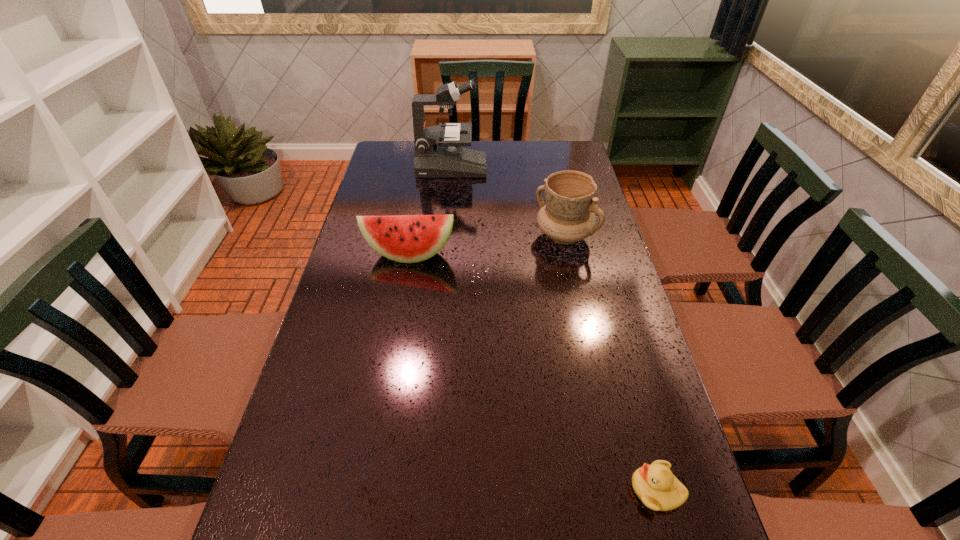
This screenshot has width=960, height=540. I want to click on vacant region located 0.100m on the front-facing side of the shortest object, so click(x=578, y=490).

Find the location of `vacant space located on the front-facing side of the shortest object`. vacant space located on the front-facing side of the shortest object is located at coordinates (567, 490).

The height and width of the screenshot is (540, 960). I want to click on object at the far edge, so click(x=438, y=149).

You are a GUI agent. You are given a task and a screenshot of the screen. Output one action in this format:
    pyautogui.click(x=<x>, y=<y>)
    Task: Click on the microscope that is positioned at the left edge
    The height and width of the screenshot is (540, 960).
    Given the screenshot: What is the action you would take?
    pyautogui.click(x=438, y=149)

Locate an element on the screen. watermelon that is at the left edge is located at coordinates (403, 238).

Image resolution: width=960 pixels, height=540 pixels. In order to click on pottery located at the right edge in this screenshot , I will do click(568, 215).

Identify the location of duckling that is at the right edge. This screenshot has height=540, width=960. (655, 485).

This screenshot has height=540, width=960. I want to click on object at the far left corner, so click(438, 149).

Locate an element on the screen. The image size is (960, 540). vacant space at the far edge of the desktop is located at coordinates (501, 160).

In the image, there is a desktop. At what (x,y) coordinates should I click in order to perform the action: click on blank space at the left edge. Please return your answer as a coordinate pair (x, y). The width and height of the screenshot is (960, 540). Looking at the image, I should click on (351, 430).